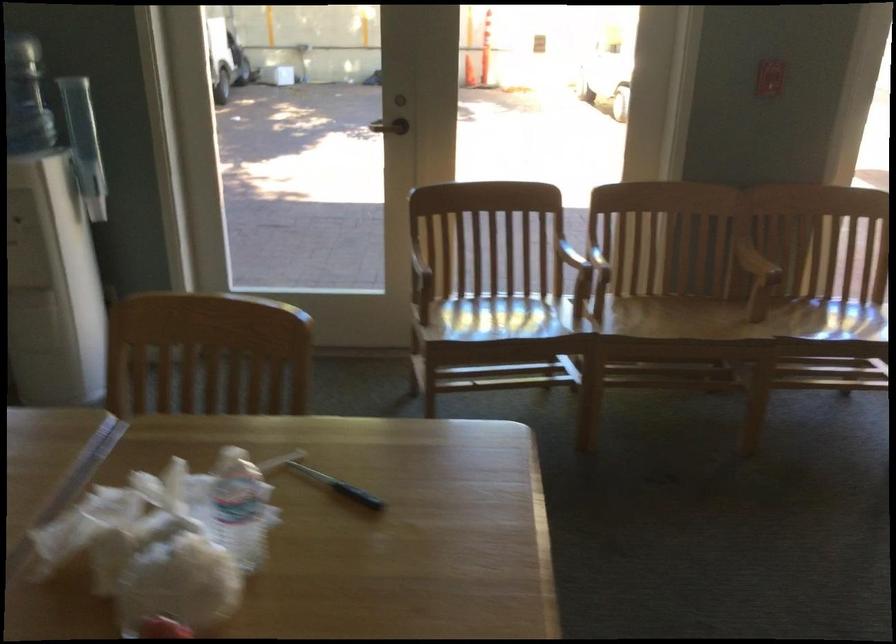
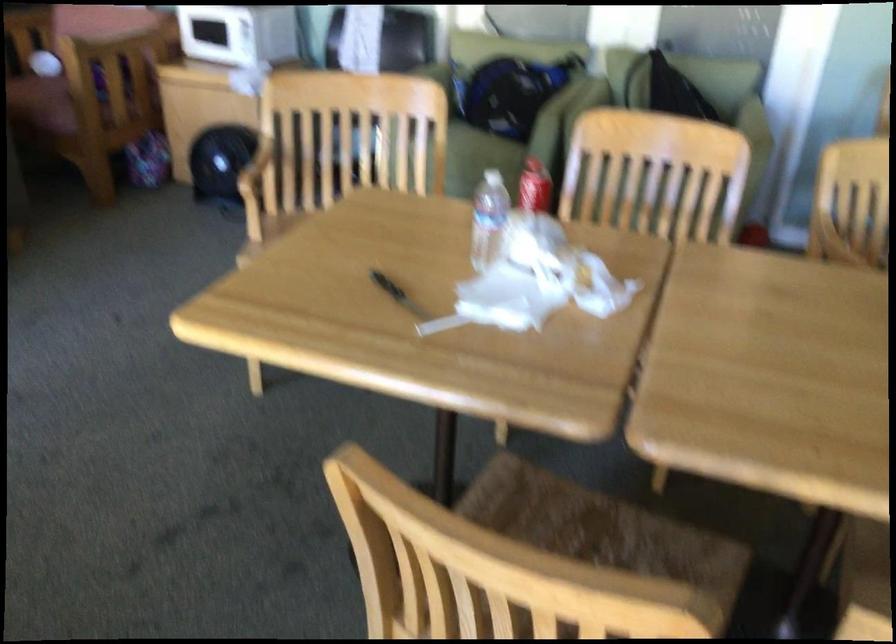
In the second image, find the point that corresponds to [115,558] in the first image.

(487, 218)